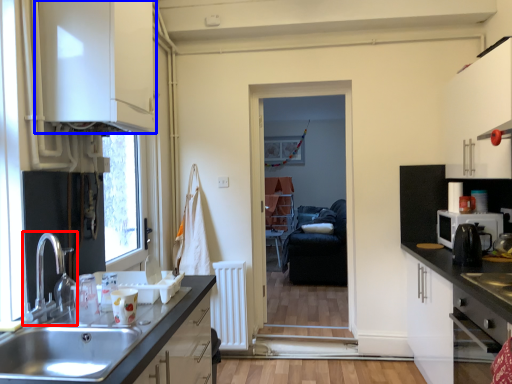
Question: Which point is closer to the camera, tap (highlighted by a red box) or cabinetry (highlighted by a blue box)?

Choices:
 (A) tap
 (B) cabinetry

Answer: (A)